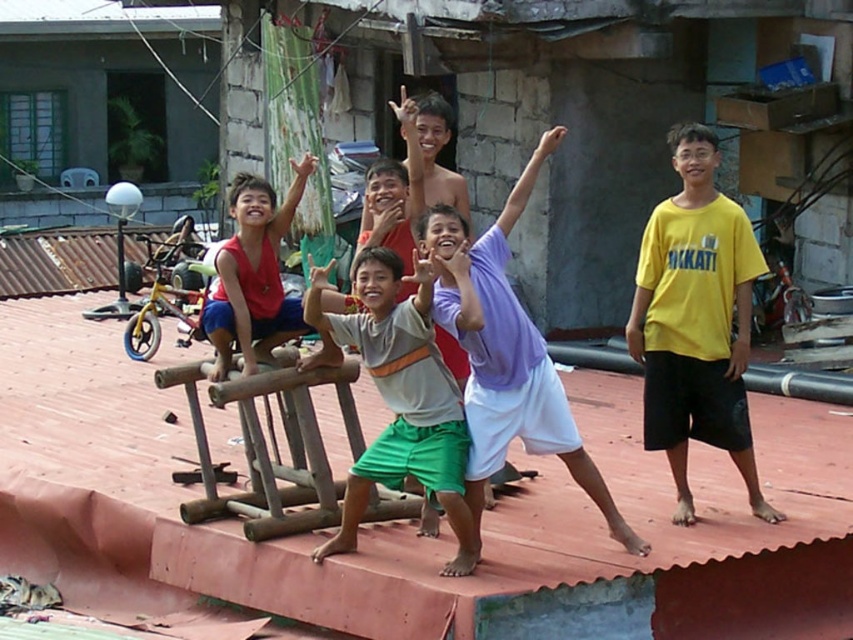
Who is higher up, purple cotton shirt at center or matte red tank top at center?

matte red tank top at center is higher up.

Where is `purple cotton shirt at center`? purple cotton shirt at center is located at coordinates (508, 353).

I want to click on purple cotton shirt at center, so click(508, 353).

You are a GUI agent. You are given a task and a screenshot of the screen. Output one action in this format:
    pyautogui.click(x=<x>, y=<y>)
    Task: Click on the green cotton shorts at center
    
    Given the screenshot: What is the action you would take?
    pyautogui.click(x=401, y=401)

Is point (386, 376) positioned in front of point (231, 336)?

Yes.

In order to click on green cotton shorts at center in this screenshot , I will do `click(401, 401)`.

Where is `green cotton shorts at center`? green cotton shorts at center is located at coordinates (401, 401).

Can you confirm if yellow cotton shirt at right is shorter than purple cotton shirt at center?

Indeed, yellow cotton shirt at right has a lesser height compared to purple cotton shirt at center.

Is point (682, 177) positioned before point (488, 333)?

No.

This screenshot has height=640, width=853. I want to click on yellow cotton shirt at right, so click(695, 321).